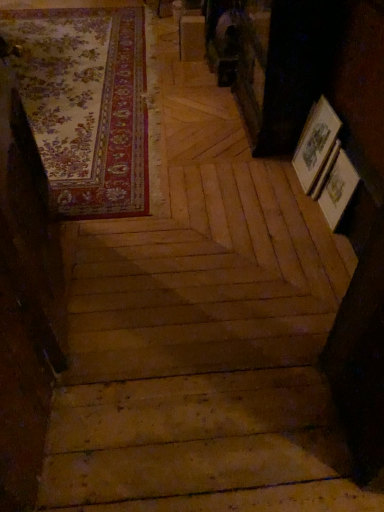
Question: Can you confirm if floral carpet at upper left is thinner than wooden stairs at center?

Choices:
 (A) no
 (B) yes

Answer: (B)

Question: From a real-world perspective, is floral carpet at upper left located higher than wooden stairs at center?

Choices:
 (A) no
 (B) yes

Answer: (A)

Question: Is there a large distance between floral carpet at upper left and wooden stairs at center?

Choices:
 (A) yes
 (B) no

Answer: (A)

Question: Could you tell me if floral carpet at upper left is turned towards wooden stairs at center?

Choices:
 (A) yes
 (B) no

Answer: (A)

Question: Is wooden stairs at center surrounded by floral carpet at upper left?

Choices:
 (A) yes
 (B) no

Answer: (A)

Question: From the image's perspective, would you say floral carpet at upper left is positioned over wooden stairs at center?

Choices:
 (A) yes
 (B) no

Answer: (A)

Question: Is the surface of wooden stairs at center in direct contact with floral carpet at upper left?

Choices:
 (A) no
 (B) yes

Answer: (A)

Question: Is wooden stairs at center facing towards floral carpet at upper left?

Choices:
 (A) no
 (B) yes

Answer: (B)

Question: Does wooden stairs at center have a smaller size compared to floral carpet at upper left?

Choices:
 (A) yes
 (B) no

Answer: (B)

Question: Could floral carpet at upper left be considered to be inside wooden stairs at center?

Choices:
 (A) no
 (B) yes

Answer: (B)

Question: Would you say wooden stairs at center is outside floral carpet at upper left?

Choices:
 (A) yes
 (B) no

Answer: (B)

Question: Can you confirm if wooden stairs at center is shorter than floral carpet at upper left?

Choices:
 (A) yes
 (B) no

Answer: (A)

Question: Is wooden stairs at center in front of or behind floral carpet at upper left in the image?

Choices:
 (A) behind
 (B) front

Answer: (B)